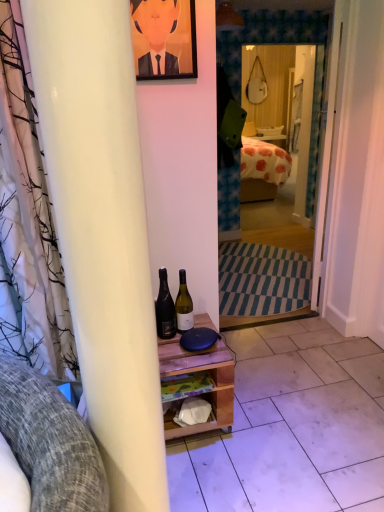
The width and height of the screenshot is (384, 512). I want to click on free space on the front side of white tile at lower right, which is the first tile from right to left, so click(357, 415).